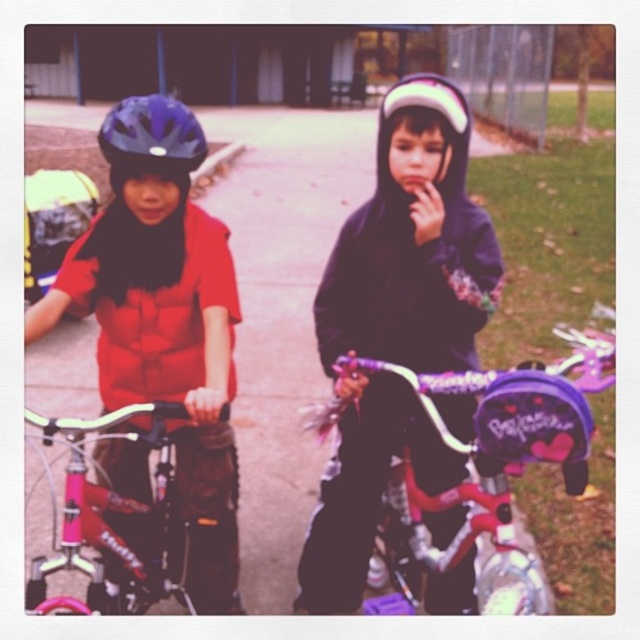
Question: In this image, where is matte black helmet at left located relative to white matte helmet at center?

Choices:
 (A) above
 (B) below

Answer: (B)

Question: Can you confirm if matte black helmet at left is bigger than white matte helmet at center?

Choices:
 (A) no
 (B) yes

Answer: (B)

Question: Estimate the real-world distances between objects in this image. Which object is closer to the shiny pink bicycle at center?

Choices:
 (A) matte black helmet at upper left
 (B) matte black hoodie at center
 (C) white matte helmet at center
 (D) pink metallic bicycle at left

Answer: (B)

Question: Which of the following is the farthest from the observer?

Choices:
 (A) (67, 474)
 (B) (451, 109)
 (C) (176, 120)
 (D) (476, 504)

Answer: (D)

Question: Which point appears farthest from the camera in this image?

Choices:
 (A) (180, 106)
 (B) (461, 182)

Answer: (B)

Question: Does shiny pink bicycle at center come behind pink metallic bicycle at left?

Choices:
 (A) yes
 (B) no

Answer: (B)